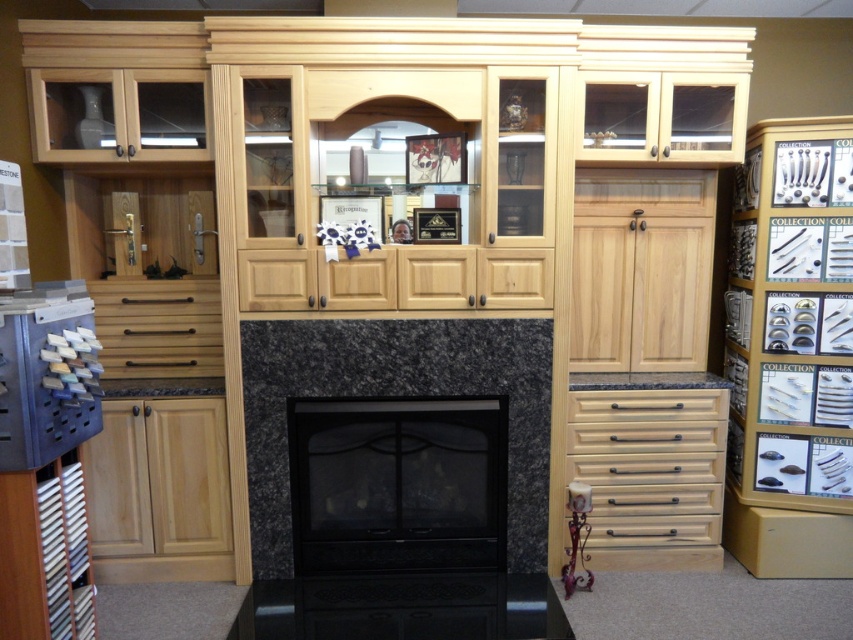
You are standing in front of the entertainment center and want to reach both the light wood drawer at lower right and the matte wood drawer at center. If your arm can extend 5 feet, can you comfortably reach both drawers without moving your position?

The light wood drawer at lower right is 5.65 feet away from matte wood drawer at center. Since your arm can only extend 5 feet, you cannot comfortably reach both drawers without moving your position because the distance between them exceeds your arm reach.

You are organizing a small sculpture that is 10 cm tall. You need to place it in one of the drawers so that it doesn t fall over. Which drawer between the light wood drawer at lower right and the matte wood drawer at center is more suitable?

The light wood drawer at lower right has a greater height compared to matte wood drawer at center, so it is more suitable for placing the small sculpture that is 10 cm tall to prevent it from falling over.

You are organizing a living room and want to place a small plant between the light wood drawer at lower right and the matte wood drawer at center. Based on their positions, which drawer should the plant be closer to?

The light wood drawer at lower right is closer to the viewer than the matte wood drawer at center, so the plant should be placed closer to the light wood drawer at lower right to maintain symmetry from the observer perspective.